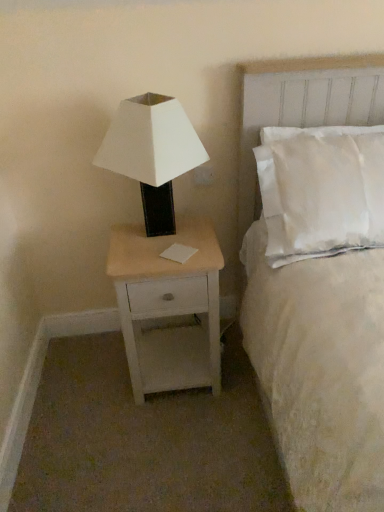
Identify the location of vacant space situated above light wood/white painted nightstand at lower left (from a real-world perspective). The image size is (384, 512). coord(166,245).